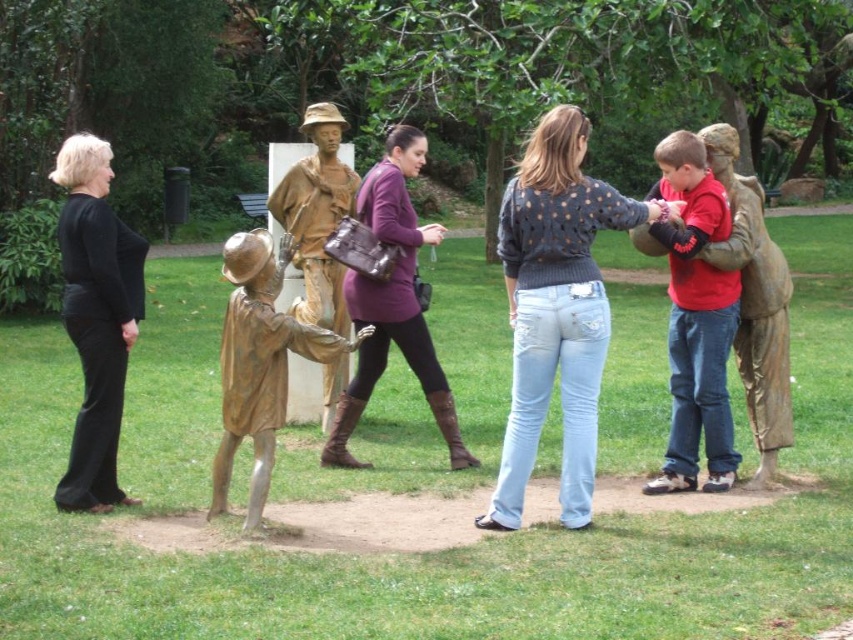
You are a photographer trying to capture a photo of both the matte red shirt at center and the matte purple sweater at center in the same frame. Which object should you focus on first to ensure both are in the frame?

You should focus on the matte purple sweater at center first because it is larger than the matte red shirt at center, allowing you to frame both effectively.

You are a photographer trying to capture a photo of the bronze statue at center without any people in the frame. The matte purple sweater at center is currently blocking your view. Which direction should you move to avoid the obstruction?

The matte purple sweater at center is to the right of the bronze statue at center. To avoid the obstruction, you should move to the left side of the bronze statue at center.